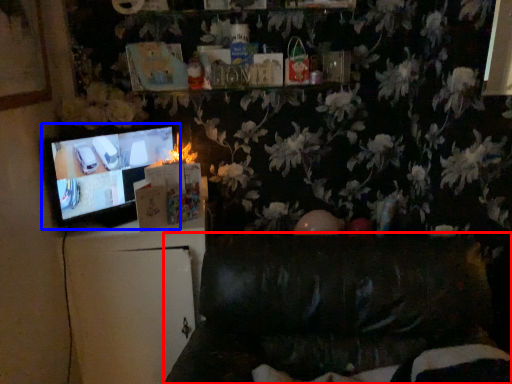
Question: Among these objects, which one is nearest to the camera, furniture (highlighted by a red box) or television (highlighted by a blue box)?

Choices:
 (A) furniture
 (B) television

Answer: (A)